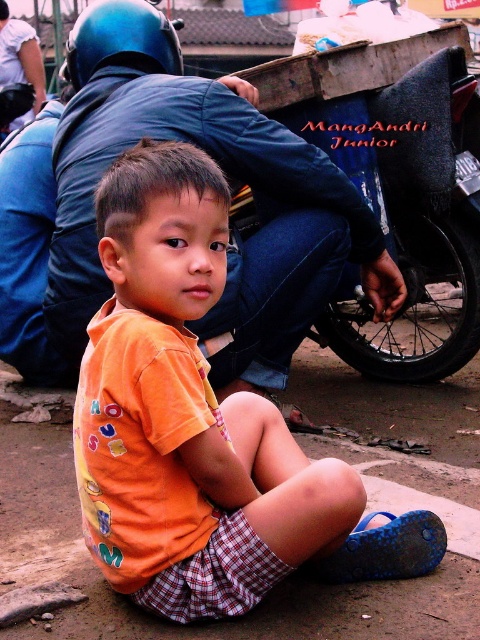
You are standing at the point marked by the coordinates point (22,80) and want to reach the point marked by point (268,195). Which direction should you move to get there?

To move from point (22,80) to point (268,195), you should move forward since point (268,195) is in front of point (22,80).

What is the location of the point labeled as point (288, 577) in the image?

The point labeled as point (288, 577) is located on the brown dirt pavement at center.

You are a photographer standing in front of the orange cotton shirt at center and the blue matte helmet at upper left. Which object should you focus on first to ensure it appears sharp in your photo?

You should focus on the orange cotton shirt at center first because it is closer to the viewer than the blue matte helmet at upper left, so it requires proper focus adjustment before capturing the background elements.